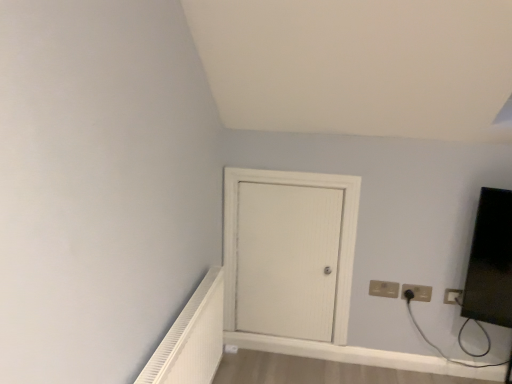
Question: Is matte black outlet at upper right, which is the second electric outlet in left-to-right order, inside white plastic electric outlet at upper right, the third electric outlet when ordered from left to right?

Choices:
 (A) no
 (B) yes

Answer: (A)

Question: Does white plastic electric outlet at upper right, the third electric outlet when ordered from left to right, have a greater height compared to matte black outlet at upper right, which is the second electric outlet in left-to-right order?

Choices:
 (A) yes
 (B) no

Answer: (A)

Question: From the image's perspective, is white plastic electric outlet at upper right, marked as the 1th electric outlet in a right-to-left arrangement, under matte black outlet at upper right, which is the second electric outlet in left-to-right order?

Choices:
 (A) no
 (B) yes

Answer: (B)

Question: Is white plastic electric outlet at upper right, marked as the 1th electric outlet in a right-to-left arrangement, further to the viewer compared to matte black outlet at upper right, the 2th electric outlet positioned from the right?

Choices:
 (A) yes
 (B) no

Answer: (B)

Question: Does white plastic electric outlet at upper right, the third electric outlet when ordered from left to right, have a lesser height compared to matte black outlet at upper right, the 2th electric outlet positioned from the right?

Choices:
 (A) no
 (B) yes

Answer: (A)

Question: Considering the positions of white plastic electric outlet at upper right, the third electric outlet when ordered from left to right, and beige plastic electric outlet at lower right, the third electric outlet positioned from the right, in the image, is white plastic electric outlet at upper right, the third electric outlet when ordered from left to right, taller or shorter than beige plastic electric outlet at lower right, the third electric outlet positioned from the right,?

Choices:
 (A) short
 (B) tall

Answer: (B)

Question: Considering the positions of white plastic electric outlet at upper right, marked as the 1th electric outlet in a right-to-left arrangement, and beige plastic electric outlet at lower right, placed as the 1th electric outlet when sorted from left to right, in the image, is white plastic electric outlet at upper right, marked as the 1th electric outlet in a right-to-left arrangement, wider or thinner than beige plastic electric outlet at lower right, placed as the 1th electric outlet when sorted from left to right,?

Choices:
 (A) thin
 (B) wide

Answer: (A)

Question: Relative to beige plastic electric outlet at lower right, placed as the 1th electric outlet when sorted from left to right, is white plastic electric outlet at upper right, the third electric outlet when ordered from left to right, in front or behind?

Choices:
 (A) front
 (B) behind

Answer: (A)

Question: Would you say white plastic electric outlet at upper right, the third electric outlet when ordered from left to right, is to the left or to the right of beige plastic electric outlet at lower right, the third electric outlet positioned from the right, in the picture?

Choices:
 (A) left
 (B) right

Answer: (B)

Question: Looking at the image, does beige plastic electric outlet at lower right, the third electric outlet positioned from the right, seem bigger or smaller compared to white wood door at center?

Choices:
 (A) small
 (B) big

Answer: (A)

Question: Based on their positions, is beige plastic electric outlet at lower right, the third electric outlet positioned from the right, located to the left or right of white wood door at center?

Choices:
 (A) left
 (B) right

Answer: (B)

Question: From a real-world perspective, is beige plastic electric outlet at lower right, placed as the 1th electric outlet when sorted from left to right, above or below white wood door at center?

Choices:
 (A) above
 (B) below

Answer: (B)

Question: Is beige plastic electric outlet at lower right, the third electric outlet positioned from the right, taller or shorter than white wood door at center?

Choices:
 (A) tall
 (B) short

Answer: (B)

Question: Considering the positions of point pos(461,291) and point pos(198,365), is point pos(461,291) closer or farther from the camera than point pos(198,365)?

Choices:
 (A) farther
 (B) closer

Answer: (A)

Question: From a real-world perspective, is white plastic electric outlet at upper right, the third electric outlet when ordered from left to right, positioned above or below white textured radiator at lower left?

Choices:
 (A) above
 (B) below

Answer: (A)